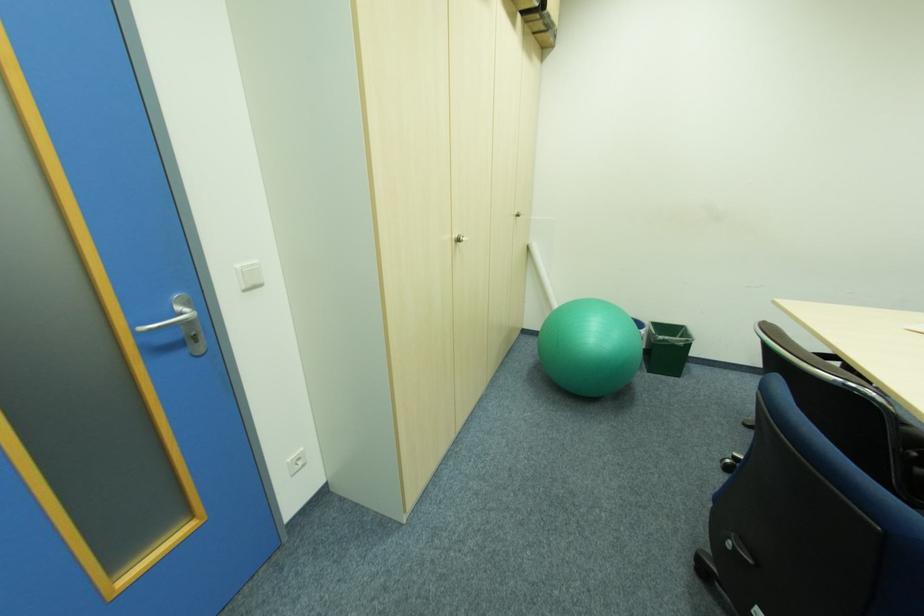
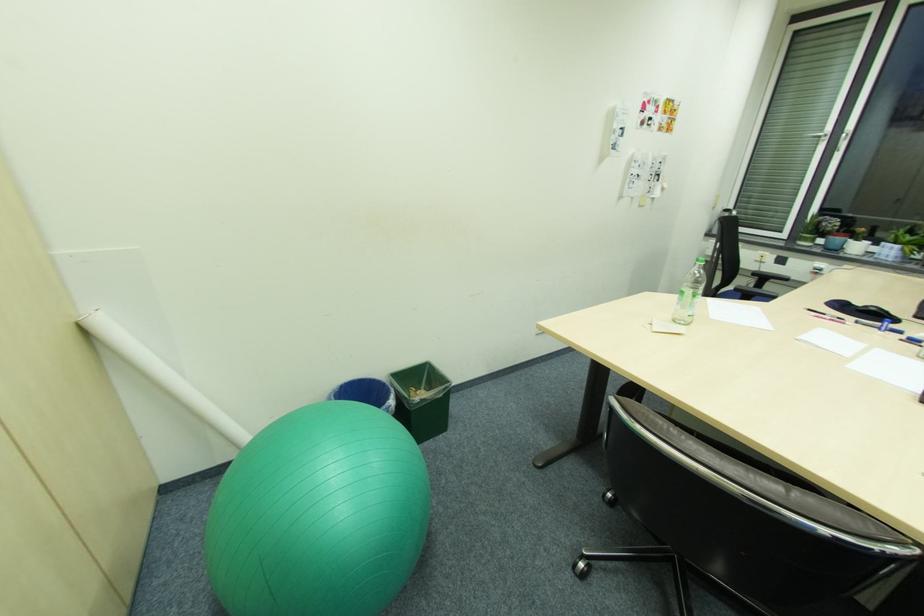
Where in the second image is the point corresponding to (x=687, y=344) from the first image?

(447, 395)